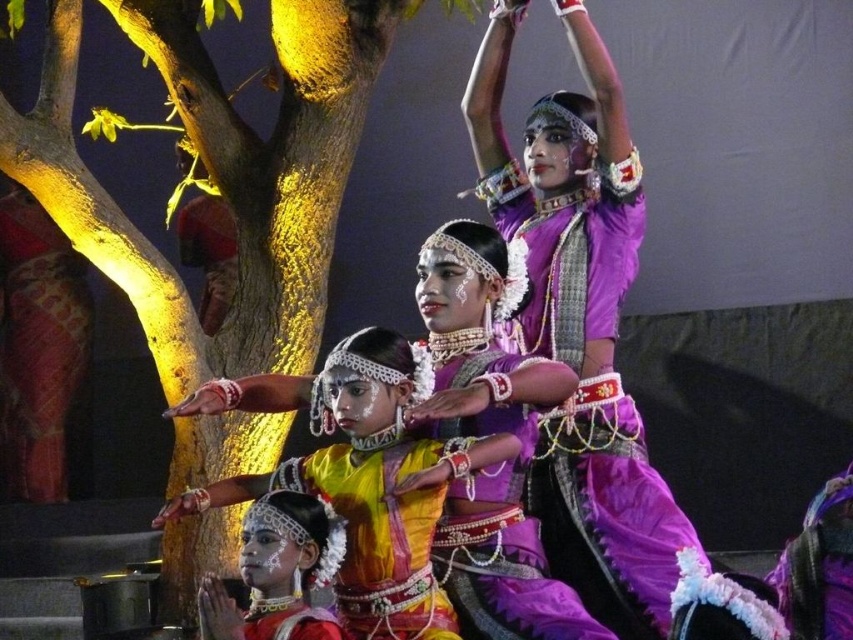
Is point (433, 552) positioned in front of point (281, 628)?

No, (433, 552) is behind (281, 628).

Describe the element at coordinates (495, 509) in the screenshot. This screenshot has height=640, width=853. I see `purple satin saree at center` at that location.

You are a GUI agent. You are given a task and a screenshot of the screen. Output one action in this format:
    pyautogui.click(x=<x>, y=<y>)
    Task: Click on the purple satin saree at center
    The image size is (853, 640).
    Given the screenshot: What is the action you would take?
    pyautogui.click(x=495, y=509)

Is yellow satin saree at center closer to the viewer compared to purple satin saree at center?

That is True.

Does yellow satin saree at center have a greater width compared to purple satin saree at center?

Indeed, yellow satin saree at center has a greater width compared to purple satin saree at center.

Which is in front, point (376, 416) or point (511, 364)?

Point (376, 416)

Find the location of `yellow satin saree at center`. yellow satin saree at center is located at coordinates (373, 490).

Which is more to the right, purple satin saree at upper center or yellow satin saree at center?

Positioned to the right is purple satin saree at upper center.

Is point (515, 182) more distant than point (386, 412)?

Yes.

The image size is (853, 640). Find the location of `purple satin saree at upper center`. purple satin saree at upper center is located at coordinates 590,397.